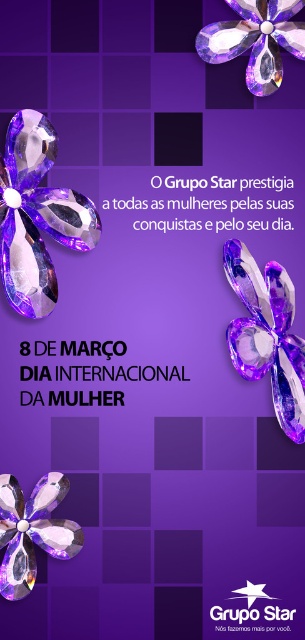
Question: Which object is closer to the camera taking this photo?

Choices:
 (A) crystal clear flower at left
 (B) matte purple flower at lower left
 (C) amber crystal flower at upper center

Answer: (C)

Question: Is matte purple flower at lower left above amber crystal flower at upper center?

Choices:
 (A) yes
 (B) no

Answer: (B)

Question: Can you confirm if crystal clear flower at left is positioned above matte purple flower at upper right?

Choices:
 (A) yes
 (B) no

Answer: (A)

Question: Which object is the farthest from the crystal clear flower at left?

Choices:
 (A) matte purple flower at upper right
 (B) amber crystal flower at upper center

Answer: (B)

Question: Is crystal clear flower at left smaller than matte purple flower at upper right?

Choices:
 (A) yes
 (B) no

Answer: (B)

Question: Which is nearer to the matte purple flower at upper right?

Choices:
 (A) crystal clear flower at left
 (B) matte purple flower at lower left
 (C) amber crystal flower at upper center

Answer: (C)